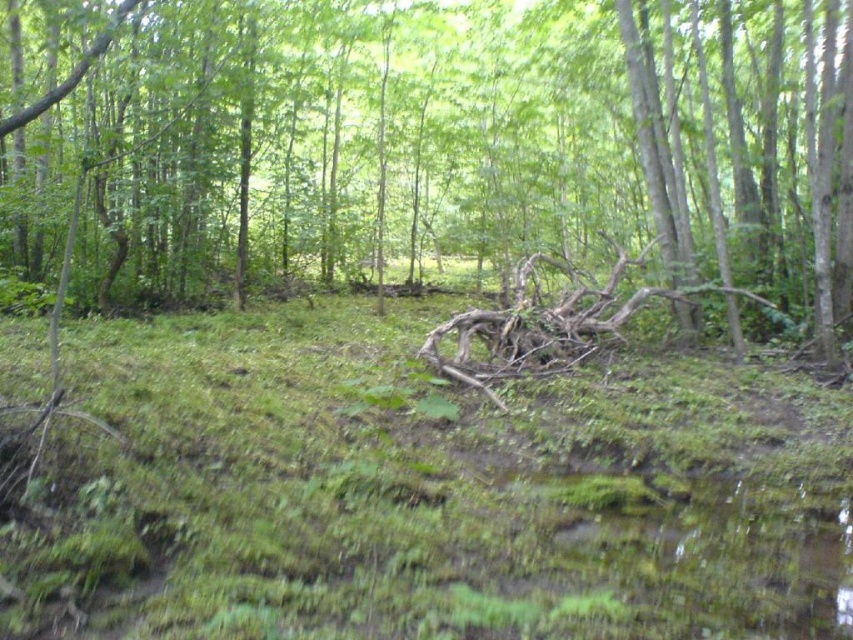
Does brown wood log at center have a greater width compared to brown rough branch at center?

Correct, the width of brown wood log at center exceeds that of brown rough branch at center.

In order to click on brown wood log at center in this screenshot , I will do `click(436, 147)`.